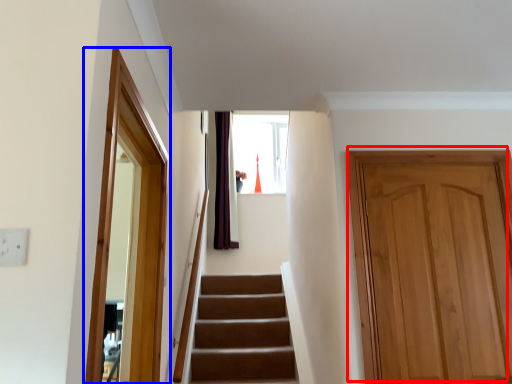
Question: Which object appears closest to the camera in this image, door (highlighted by a red box) or screen door (highlighted by a blue box)?

Choices:
 (A) door
 (B) screen door

Answer: (B)